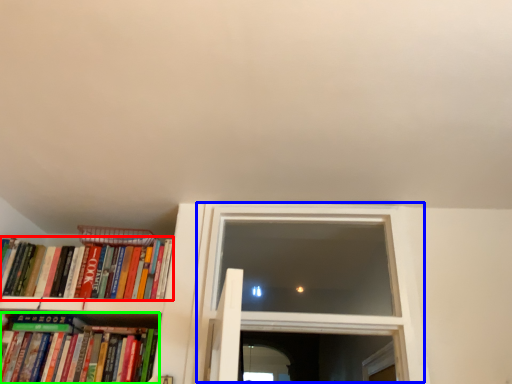
Question: Considering the real-world distances, which object is closest to book (highlighted by a red box)? window (highlighted by a blue box) or book (highlighted by a green box).

Choices:
 (A) window
 (B) book

Answer: (B)